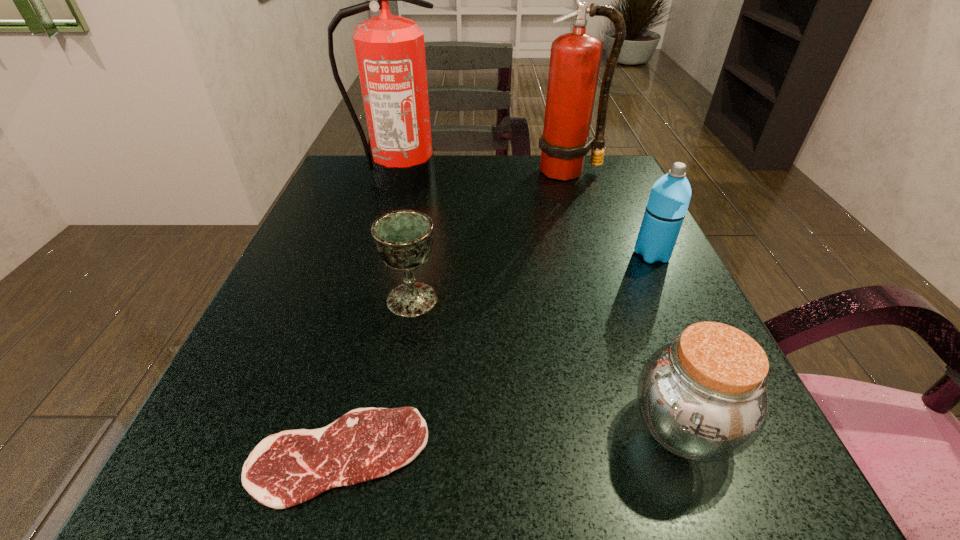
Select which object appears as the third closest to the third nearest object. Please provide its 2D coordinates. Your answer should be formatted as a tuple, i.e. [(x, y)], where the tuple contains the x and y coordinates of a point satisfying the conditions above.

[(390, 51)]

Locate which object ranks third in proximity to the thermos bottle. Please provide its 2D coordinates. Your answer should be formatted as a tuple, i.e. [(x, y)], where the tuple contains the x and y coordinates of a point satisfying the conditions above.

[(403, 239)]

Identify the location of vacant space that satisfies the following two spatial constraints: 1. on the front side of the left fire extinguisher; 2. on the left side of the steak. Image resolution: width=960 pixels, height=540 pixels. (320, 456).

At what (x,y) coordinates should I click in order to perform the action: click on blank space that satisfies the following two spatial constraints: 1. on the back side of the steak; 2. on the left side of the fourth farthest object. Please return your answer as a coordinate pair (x, y). The image size is (960, 540). Looking at the image, I should click on (378, 300).